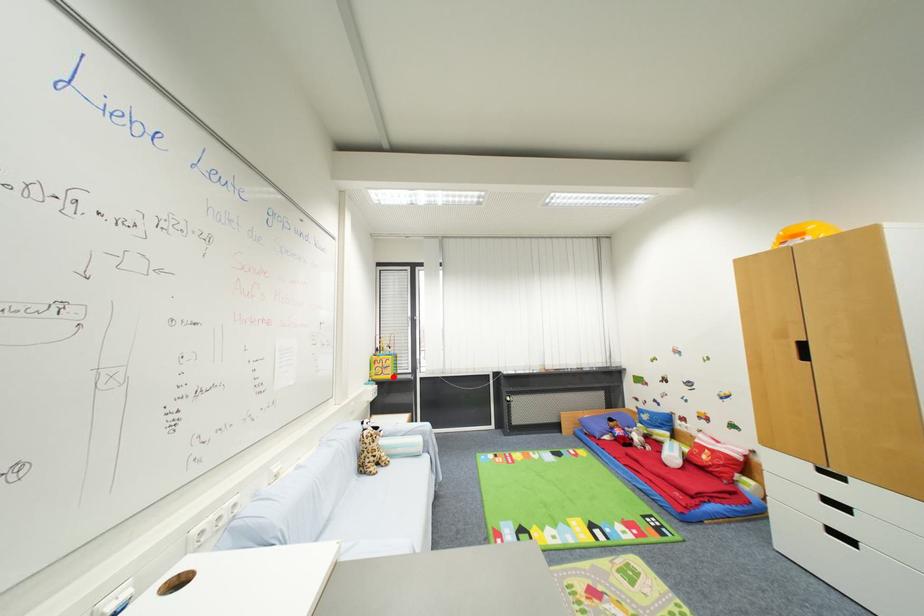
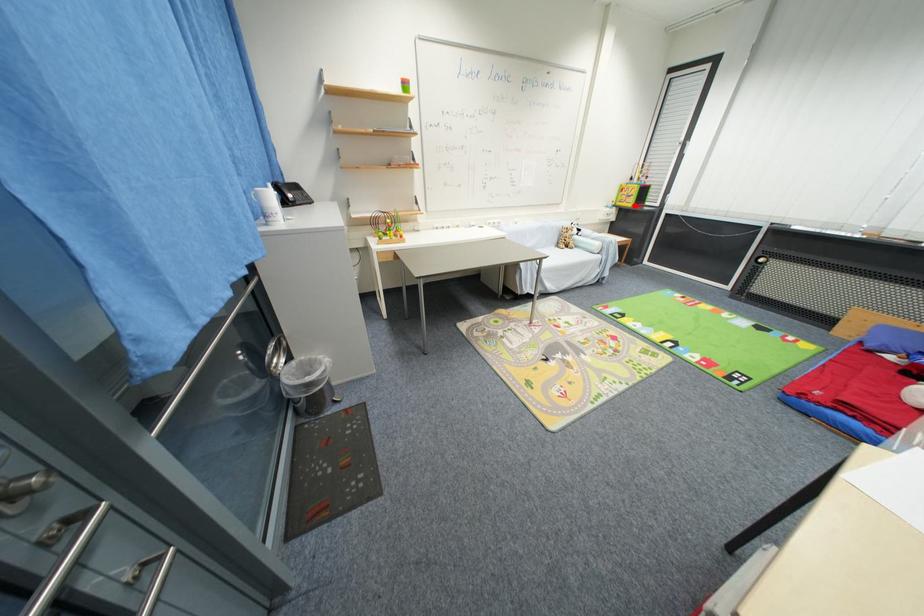
I am providing you with two images of the same scene from different viewpoints. A red point is marked on the first image and another point is marked on the second image. Does the point marked in image1 correspond to the same location as the one in image2?

Yes